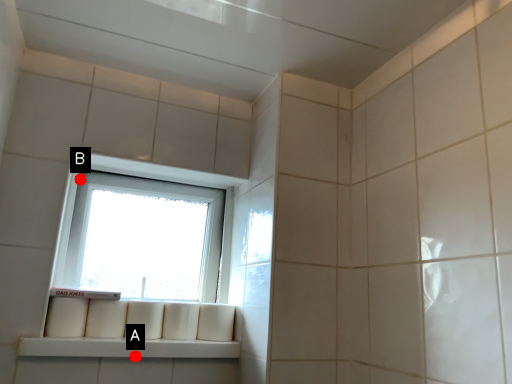
Question: Two points are circled on the image, labeled by A and B beside each circle. Which point is farther from the camera taking this photo?

Choices:
 (A) A is further
 (B) B is further

Answer: (B)